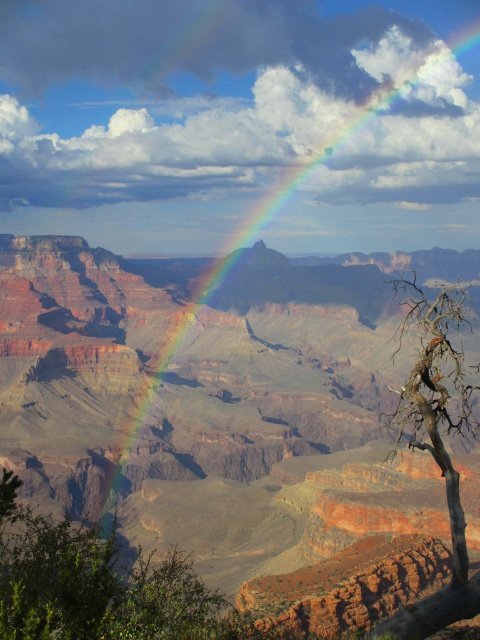
Can you confirm if rainbow at upper center is positioned to the right of dead wood tree at right?

No, rainbow at upper center is not to the right of dead wood tree at right.

Measure the distance between point (225, 113) and camera.

Point (225, 113) and camera are 675.18 meters apart.

Which is behind, point (166, 180) or point (464, 577)?

Positioned behind is point (166, 180).

The width and height of the screenshot is (480, 640). Find the location of `rainbow at upper center`. rainbow at upper center is located at coordinates (294, 138).

Is rustic sandstone canyon at center below dead wood tree at right?

No, rustic sandstone canyon at center is not below dead wood tree at right.

Who is taller, rustic sandstone canyon at center or dead wood tree at right?

Standing taller between the two is rustic sandstone canyon at center.

You are a GUI agent. You are given a task and a screenshot of the screen. Output one action in this format:
    pyautogui.click(x=<x>, y=<y>)
    Task: Click on the rustic sandstone canyon at center
    The height and width of the screenshot is (640, 480).
    Given the screenshot: What is the action you would take?
    pyautogui.click(x=200, y=406)

Locate an element on the screen. The width and height of the screenshot is (480, 640). rustic sandstone canyon at center is located at coordinates (200, 406).

Which is more to the left, rustic sandstone canyon at center or rainbow at upper center?

rustic sandstone canyon at center

From the picture: Is rustic sandstone canyon at center to the left of rainbow at upper center from the viewer's perspective?

Yes, rustic sandstone canyon at center is to the left of rainbow at upper center.

Who is more forward, (276,340) or (210,96)?

Point (276,340) is more forward.

Find the location of a particular element. Image resolution: width=480 pixels, height=640 pixels. rustic sandstone canyon at center is located at coordinates (200, 406).